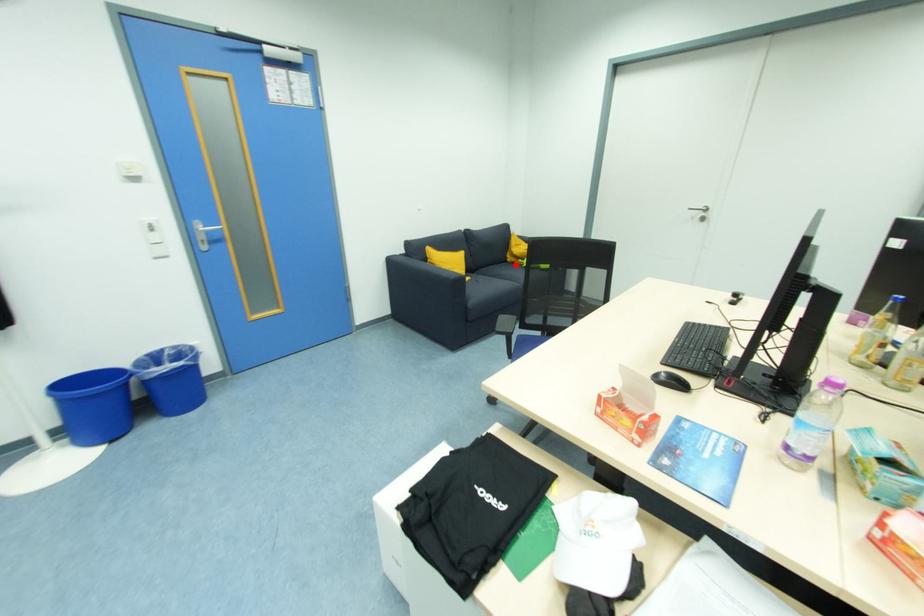
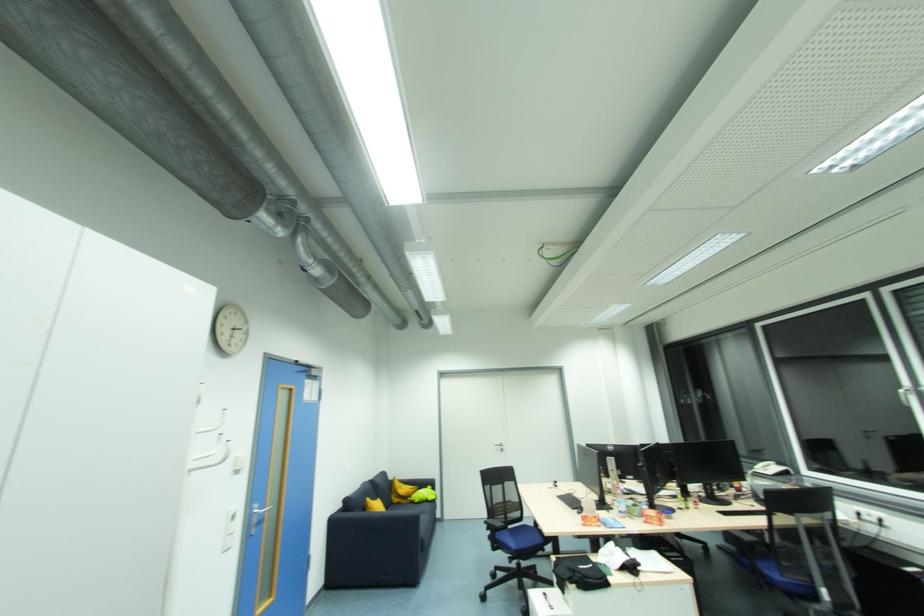
Question: I am providing you with two images of the same scene from different viewpoints. In image1, a red point is highlighted. Considering the same 3D point in image2, which of the following is correct?

Choices:
 (A) It is closer
 (B) It is farther

Answer: (B)